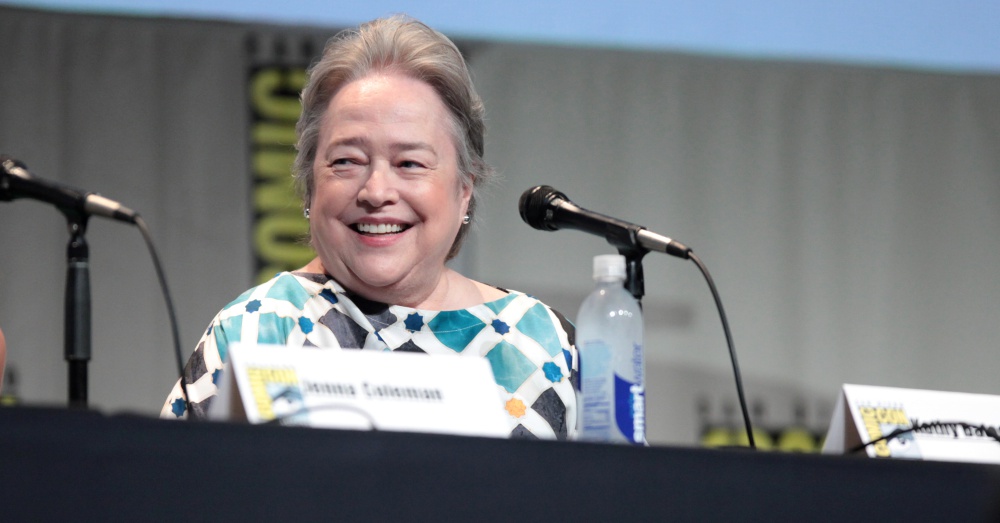
This screenshot has height=523, width=1000. Identify the location of nameplate. (962, 454).